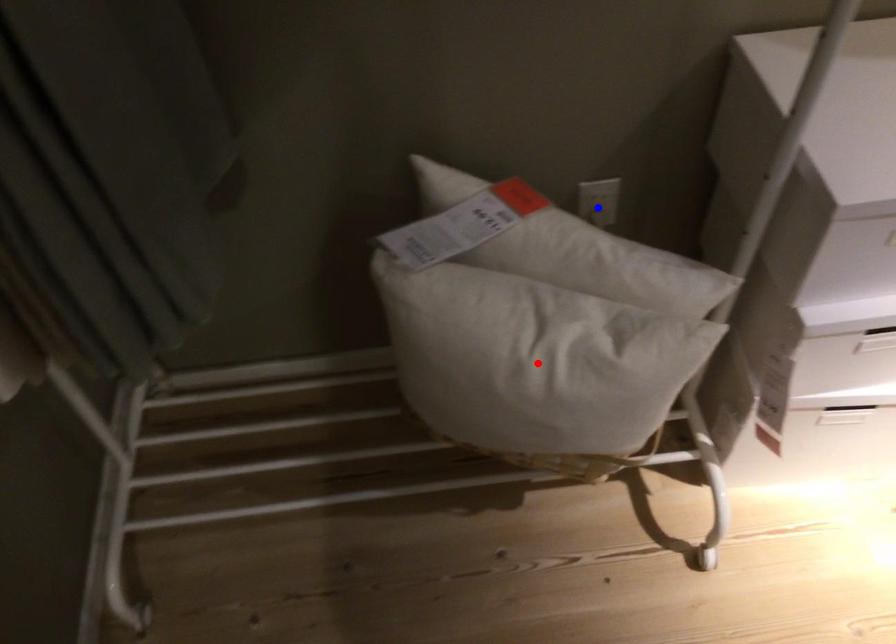
Question: Two points are marked on the image. Which point is closer to the camera?

Choices:
 (A) Blue point is closer.
 (B) Red point is closer.

Answer: (B)